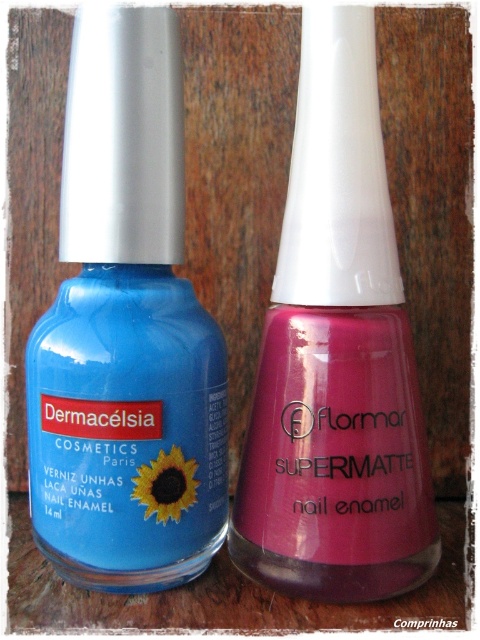
Question: Does matte blue nail enamel at left appear over matte pink nail enamel at center?

Choices:
 (A) no
 (B) yes

Answer: (A)

Question: Is matte blue nail enamel at left wider than matte pink nail enamel at center?

Choices:
 (A) yes
 (B) no

Answer: (B)

Question: Which point is closer to the camera taking this photo?

Choices:
 (A) (360, 288)
 (B) (113, 445)

Answer: (B)

Question: Can you confirm if matte blue nail enamel at left is wider than matte pink nail enamel at center?

Choices:
 (A) no
 (B) yes

Answer: (A)